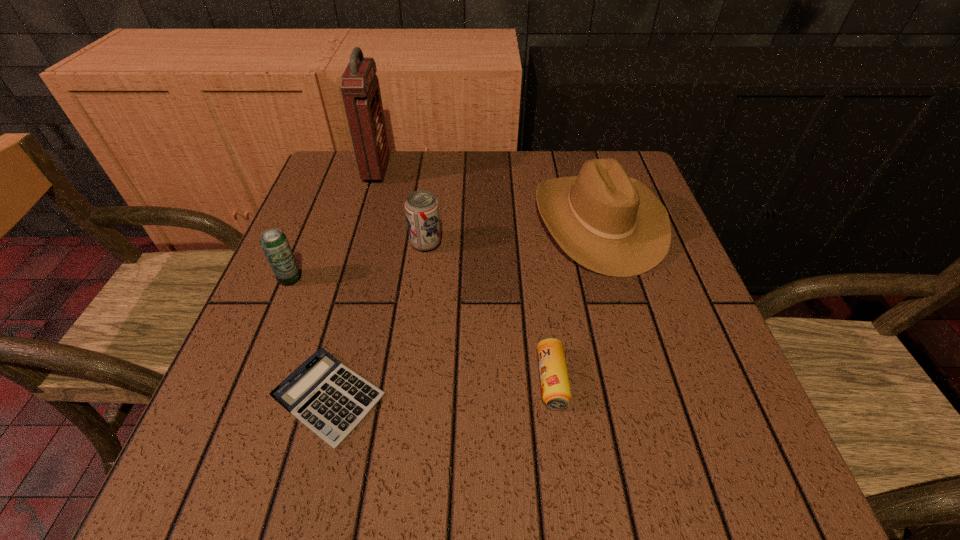
Locate an element on the screen. vacant area that lies between the cowboy hat and the second farthest beer can is located at coordinates (444, 249).

This screenshot has width=960, height=540. Find the location of `object identified as the second closest to the shortest object`. object identified as the second closest to the shortest object is located at coordinates (556, 394).

This screenshot has height=540, width=960. I want to click on object that stands as the third closest to the cowboy hat, so click(330, 399).

Locate which beer can is the closest to the second farthest beer can. Please provide its 2D coordinates. Your answer should be formatted as a tuple, i.e. [(x, y)], where the tuple contains the x and y coordinates of a point satisfying the conditions above.

[(421, 207)]

This screenshot has height=540, width=960. Identify the location of beer can that stands as the second closest to the tallest object. (274, 243).

This screenshot has width=960, height=540. I want to click on vacant space that satisfies the following two spatial constraints: 1. on the front side of the fifth tallest object; 2. on the left side of the second beer can from left to right, so click(x=408, y=380).

What are the coordinates of `free region that satisfies the following two spatial constraints: 1. on the back side of the farthest beer can; 2. on the right side of the cowboy hat` in the screenshot? It's located at click(x=429, y=220).

The image size is (960, 540). In order to click on vacant region that satisfies the following two spatial constraints: 1. on the back side of the second farthest beer can; 2. on the right side of the cowboy hat in this screenshot , I will do `click(314, 220)`.

Where is `vacant space that satisfies the following two spatial constraints: 1. on the front-facing side of the fifth tallest object; 2. on the right side of the first-aid kit`? The image size is (960, 540). vacant space that satisfies the following two spatial constraints: 1. on the front-facing side of the fifth tallest object; 2. on the right side of the first-aid kit is located at coordinates (314, 380).

At what (x,y) coordinates should I click in order to perform the action: click on free point that satisfies the following two spatial constraints: 1. on the back side of the shortest object; 2. on the right side of the shortest beer can. Please return your answer as a coordinate pair (x, y). The height and width of the screenshot is (540, 960). Looking at the image, I should click on (334, 380).